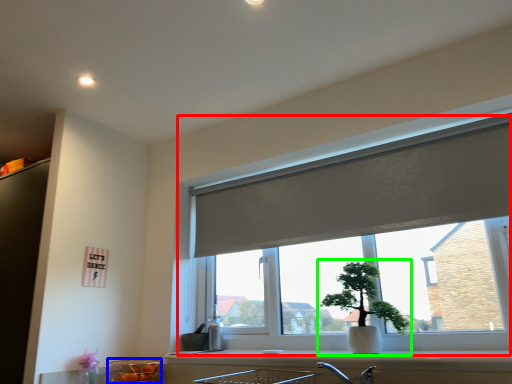
Question: Considering the real-world distances, which object is farthest from window (highlighted by a red box)? glass bowl (highlighted by a blue box) or houseplant (highlighted by a green box)?

Choices:
 (A) glass bowl
 (B) houseplant

Answer: (A)